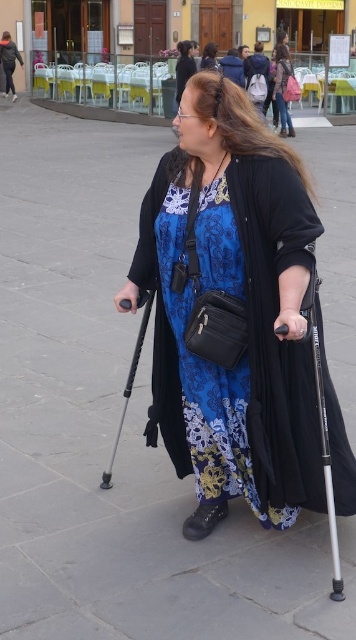
Measure the distance between black matte robe at upper left and blue floral robe at center.

30.55 feet

This screenshot has height=640, width=356. What do you see at coordinates (8, 61) in the screenshot?
I see `black matte robe at upper left` at bounding box center [8, 61].

Is point (1, 52) positioned behind point (175, 72)?

Yes, point (1, 52) is farther from viewer.

I want to click on black matte robe at upper left, so click(8, 61).

Between matte black crutches at center and black matte robe at upper left, which one has more height?

black matte robe at upper left is taller.

Between point (211, 456) and point (9, 81), which one is positioned behind?

Point (9, 81)

Does point (283, 492) come behind point (7, 81)?

No, it is in front of (7, 81).

This screenshot has height=640, width=356. I want to click on matte black crutches at center, so click(232, 310).

Can you confirm if silver metallic crutch at lower right is shorter than blue floral robe at center?

Incorrect, silver metallic crutch at lower right's height does not fall short of blue floral robe at center's.

What do you see at coordinates (321, 420) in the screenshot?
I see `silver metallic crutch at lower right` at bounding box center [321, 420].

This screenshot has width=356, height=640. In order to click on silver metallic crutch at lower right in this screenshot , I will do `click(321, 420)`.

The image size is (356, 640). Find the location of `silver metallic crutch at lower right`. silver metallic crutch at lower right is located at coordinates (321, 420).